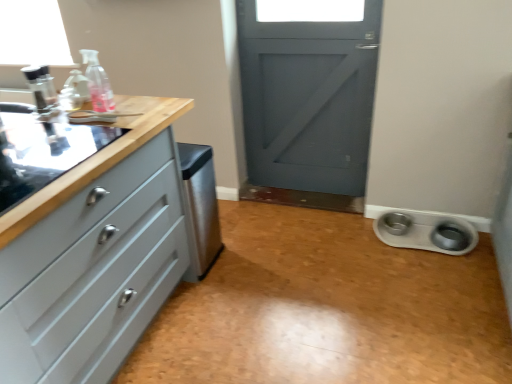
In order to click on blank area beneath black glass sink at left (from a real-world perspective) in this screenshot , I will do `click(45, 152)`.